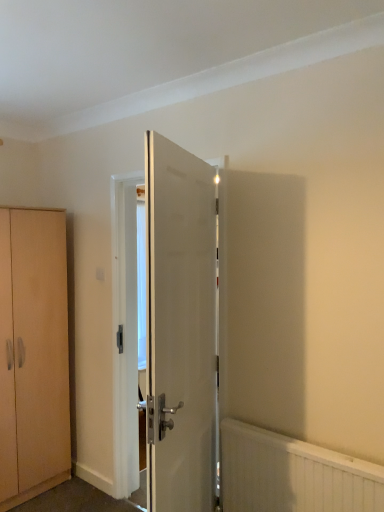
Question: Is white glossy door at center oriented away from white textured radiator at lower right?

Choices:
 (A) yes
 (B) no

Answer: (A)

Question: Does white glossy door at center lie in front of white textured radiator at lower right?

Choices:
 (A) no
 (B) yes

Answer: (B)

Question: Is white glossy door at center behind white textured radiator at lower right?

Choices:
 (A) no
 (B) yes

Answer: (A)

Question: Does white glossy door at center have a greater width compared to white textured radiator at lower right?

Choices:
 (A) no
 (B) yes

Answer: (B)

Question: From the image's perspective, is white glossy door at center over white textured radiator at lower right?

Choices:
 (A) no
 (B) yes

Answer: (B)

Question: From a real-world perspective, is white glossy door at center positioned under white textured radiator at lower right based on gravity?

Choices:
 (A) yes
 (B) no

Answer: (B)

Question: Is light brown wood cabinet at left smaller than white textured radiator at lower right?

Choices:
 (A) yes
 (B) no

Answer: (B)

Question: Does light brown wood cabinet at left have a larger size compared to white textured radiator at lower right?

Choices:
 (A) yes
 (B) no

Answer: (A)

Question: Can you confirm if light brown wood cabinet at left is taller than white textured radiator at lower right?

Choices:
 (A) yes
 (B) no

Answer: (A)

Question: Does light brown wood cabinet at left have a lesser width compared to white textured radiator at lower right?

Choices:
 (A) yes
 (B) no

Answer: (B)

Question: Does light brown wood cabinet at left come behind white textured radiator at lower right?

Choices:
 (A) yes
 (B) no

Answer: (A)

Question: From the image's perspective, would you say light brown wood cabinet at left is positioned over white textured radiator at lower right?

Choices:
 (A) no
 (B) yes

Answer: (B)

Question: Is white glossy door at center taller than light brown wood cabinet at left?

Choices:
 (A) no
 (B) yes

Answer: (A)